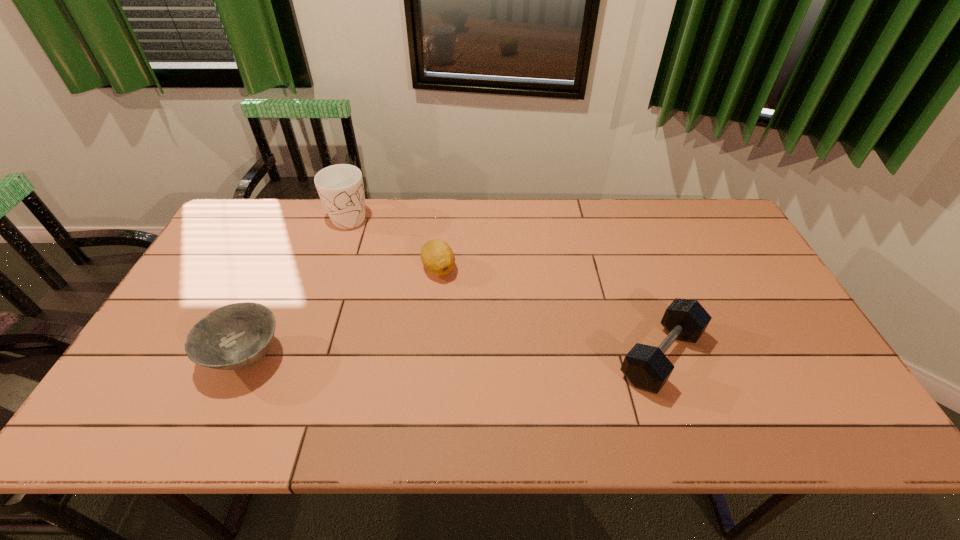
The height and width of the screenshot is (540, 960). Find the location of `bowl`. bowl is located at coordinates (236, 336).

Locate an element on the screen. This screenshot has width=960, height=540. the rightmost object is located at coordinates (646, 367).

The image size is (960, 540). In order to click on lemon in this screenshot , I will do `click(437, 256)`.

Identify the location of the third object from left to right. (437, 256).

Where is `the farthest object`? The width and height of the screenshot is (960, 540). the farthest object is located at coordinates (340, 187).

In order to click on mug in this screenshot , I will do `click(340, 187)`.

The height and width of the screenshot is (540, 960). I want to click on vacant space located 0.200m on the back of the bowl, so click(283, 274).

The image size is (960, 540). What are the coordinates of `free region located on the left of the dumbbell` in the screenshot? It's located at (561, 356).

Locate an element on the screen. Image resolution: width=960 pixels, height=540 pixels. vacant space situated at the stem end of the second farthest object is located at coordinates (435, 391).

Locate an element on the screen. vacant space located at the stem end of the second farthest object is located at coordinates (436, 359).